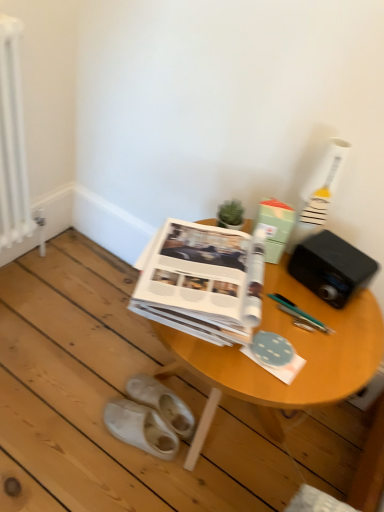
Question: Which direction should I rotate to look at white paper at center, marked as the 1th paperback book in a left-to-right arrangement?

Choices:
 (A) right
 (B) left

Answer: (A)

Question: Would you consider white paper at center, which appears as the second paperback book when viewed from the right, to be distant from wooden table at center?

Choices:
 (A) no
 (B) yes

Answer: (A)

Question: Does white paper at center, which appears as the second paperback book when viewed from the right, have a smaller size compared to wooden table at center?

Choices:
 (A) no
 (B) yes

Answer: (B)

Question: Can you confirm if white paper at center, marked as the 1th paperback book in a left-to-right arrangement, is shorter than wooden table at center?

Choices:
 (A) yes
 (B) no

Answer: (A)

Question: Is white paper at center, marked as the 1th paperback book in a left-to-right arrangement, facing towards wooden table at center?

Choices:
 (A) no
 (B) yes

Answer: (A)

Question: Is white paper at center, marked as the 1th paperback book in a left-to-right arrangement, thinner than wooden table at center?

Choices:
 (A) yes
 (B) no

Answer: (A)

Question: Considering the relative sizes of white paper at center, which appears as the second paperback book when viewed from the right, and wooden table at center in the image provided, is white paper at center, which appears as the second paperback book when viewed from the right, bigger than wooden table at center?

Choices:
 (A) yes
 (B) no

Answer: (B)

Question: Is white suede slippers at lower left, acting as the second footwear starting from the front, outside white fabric slippers at lower left, the 2th footwear when ordered from back to front?

Choices:
 (A) no
 (B) yes

Answer: (B)

Question: Is white suede slippers at lower left, acting as the second footwear starting from the front, shorter than white fabric slippers at lower left, which is the 1th footwear in front-to-back order?

Choices:
 (A) yes
 (B) no

Answer: (B)

Question: Is white suede slippers at lower left, acting as the second footwear starting from the front, wider than white fabric slippers at lower left, which is the 1th footwear in front-to-back order?

Choices:
 (A) yes
 (B) no

Answer: (A)

Question: Is white suede slippers at lower left, acting as the second footwear starting from the front, positioned with its back to white fabric slippers at lower left, which is the 1th footwear in front-to-back order?

Choices:
 (A) no
 (B) yes

Answer: (A)

Question: Is white suede slippers at lower left, acting as the second footwear starting from the front, positioned far away from white fabric slippers at lower left, which is the 1th footwear in front-to-back order?

Choices:
 (A) no
 (B) yes

Answer: (A)

Question: Can you confirm if white suede slippers at lower left, acting as the second footwear starting from the front, is bigger than white fabric slippers at lower left, which is the 1th footwear in front-to-back order?

Choices:
 (A) yes
 (B) no

Answer: (A)

Question: Is white metallic radiator at left not close to green matte paper at center, the first paperback book from the right?

Choices:
 (A) yes
 (B) no

Answer: (B)